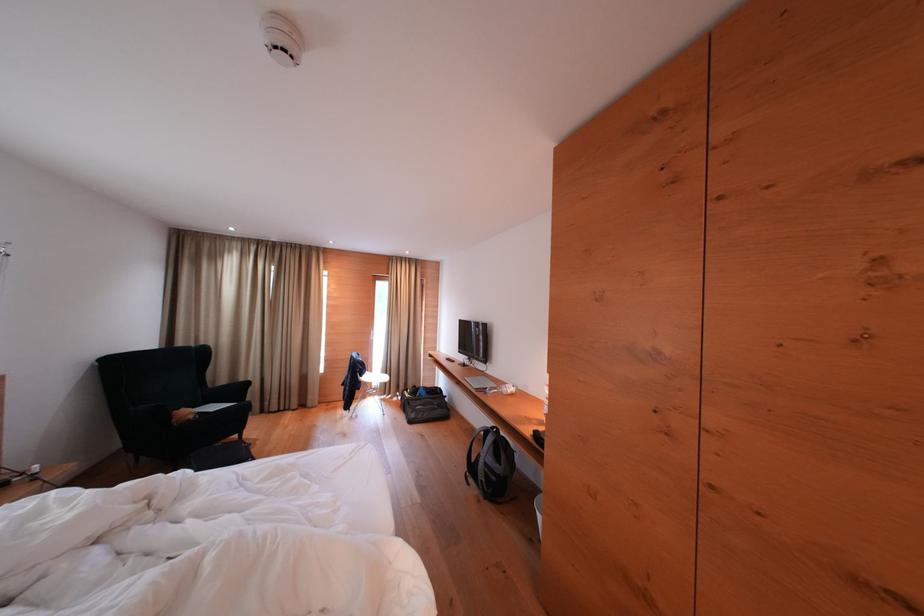
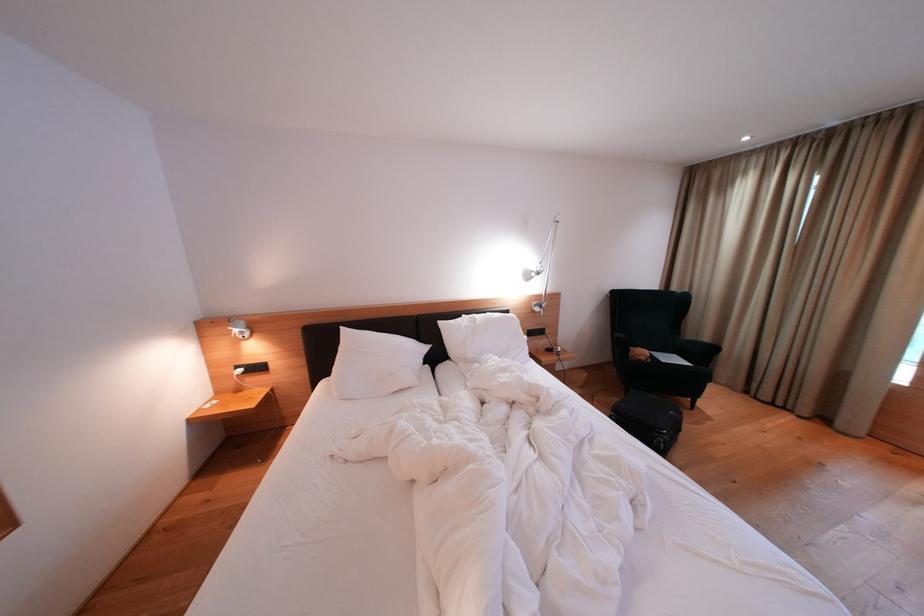
Question: Based on the continuous images, in which direction is the camera rotating? Reply with the corresponding letter.

Choices:
 (A) Left
 (B) Right
 (C) Up
 (D) Down

Answer: (A)